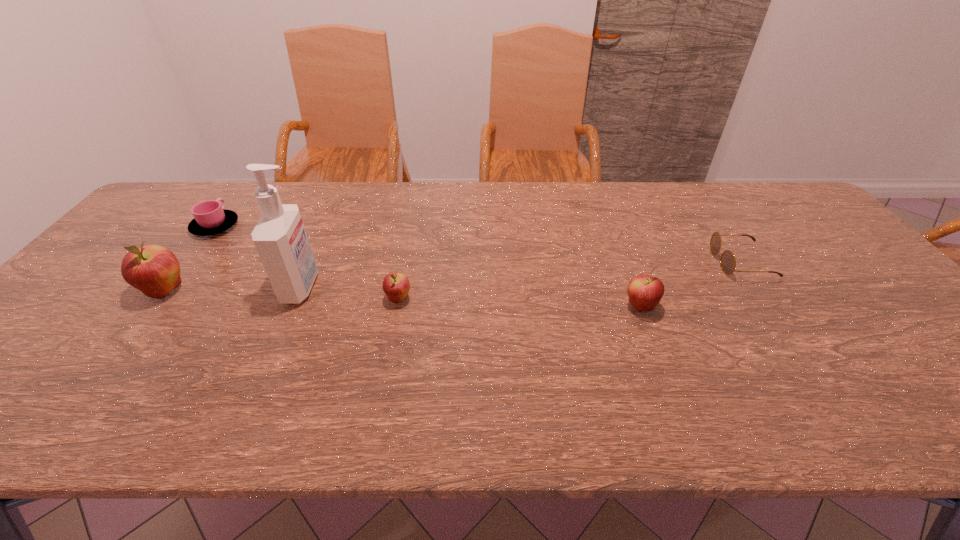
Select which apple is the second closest to the second apple from right to left. Please provide its 2D coordinates. Your answer should be formatted as a tuple, i.e. [(x, y)], where the tuple contains the x and y coordinates of a point satisfying the conditions above.

[(645, 292)]

Where is `vacant space that satisfies the following two spatial constraints: 1. on the front label of the fourth shortest object; 2. on the left side of the cleansing agent`? The height and width of the screenshot is (540, 960). vacant space that satisfies the following two spatial constraints: 1. on the front label of the fourth shortest object; 2. on the left side of the cleansing agent is located at coordinates (293, 307).

Image resolution: width=960 pixels, height=540 pixels. In order to click on vacant space that satisfies the following two spatial constraints: 1. on the front label of the tallest object; 2. on the left side of the second tallest apple in this screenshot , I will do `click(293, 307)`.